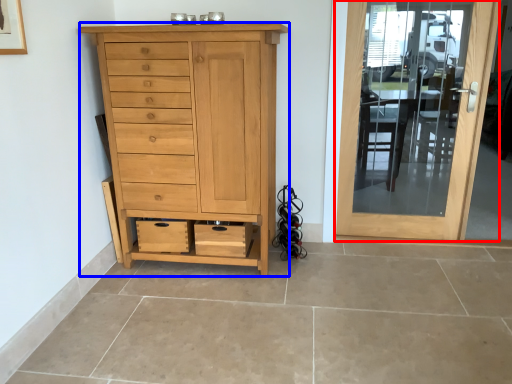
Question: Among these objects, which one is nearest to the camera, door (highlighted by a red box) or chest of drawers (highlighted by a blue box)?

Choices:
 (A) door
 (B) chest of drawers

Answer: (B)